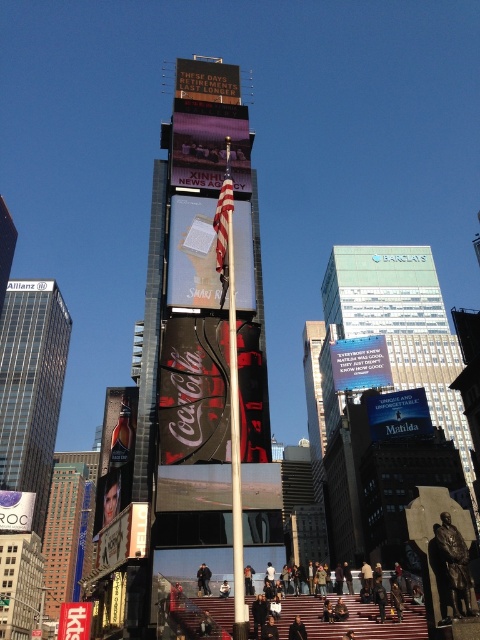
Which is in front, point (406, 621) or point (9, 520)?

Point (406, 621) is more forward.

Is red brick stairs at center taller than matte white sign at center?

Incorrect, red brick stairs at center's height is not larger of matte white sign at center's.

Is point (355, 625) positioned after point (21, 493)?

No.

This screenshot has width=480, height=640. I want to click on red brick stairs at center, so click(354, 620).

Between american flag at center and red fabric sign at center, which one has more height?

Standing taller between the two is american flag at center.

Is american flag at center behind red fabric sign at center?

No.

The height and width of the screenshot is (640, 480). What are the coordinates of `american flag at center` in the screenshot? It's located at (224, 218).

Is glassy skyscraper at left to the right of white wooden pole at center from the viewer's perspective?

No, glassy skyscraper at left is not to the right of white wooden pole at center.

Between point (20, 401) and point (239, 496), which one is positioned behind?

The point (20, 401) is behind.

The image size is (480, 640). I want to click on glassy skyscraper at left, so click(x=31, y=387).